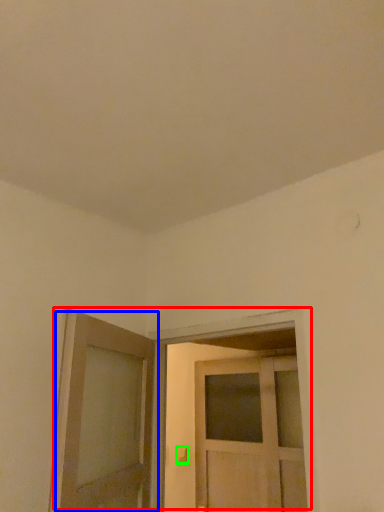
Question: Estimate the real-world distances between objects in this image. Which object is farther from door (highlighted by a red box), door (highlighted by a blue box) or door handle (highlighted by a green box)?

Choices:
 (A) door
 (B) door handle

Answer: (B)